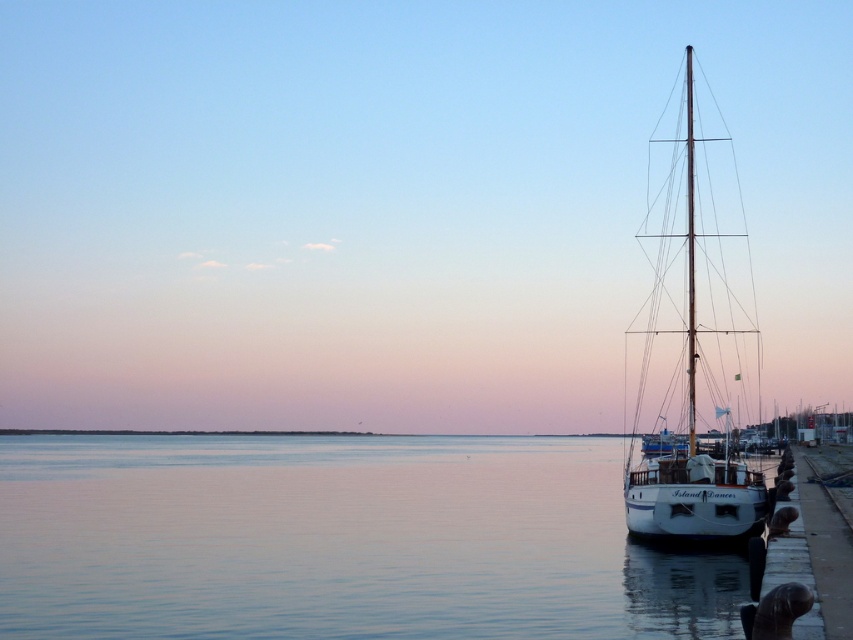
The height and width of the screenshot is (640, 853). In order to click on clear water at lower left in this screenshot , I will do click(x=339, y=541).

Does point (306, 612) come farther from viewer compared to point (688, 115)?

No, it is not.

Where is `clear water at lower left`? clear water at lower left is located at coordinates (339, 541).

From the picture: Does white polished wood sailboat at right appear on the left side of polished wood mast at right?

Incorrect, white polished wood sailboat at right is not on the left side of polished wood mast at right.

Locate an element on the screen. white polished wood sailboat at right is located at coordinates (694, 336).

Find the location of a particular element. Image resolution: width=853 pixels, height=640 pixels. white polished wood sailboat at right is located at coordinates (694, 336).

Which is behind, point (653, 582) or point (758, 483)?

Positioned behind is point (758, 483).

Is clear water at lower left positioned before white polished wood sailboat at right?

Yes.

Identify the location of clear water at lower left. (339, 541).